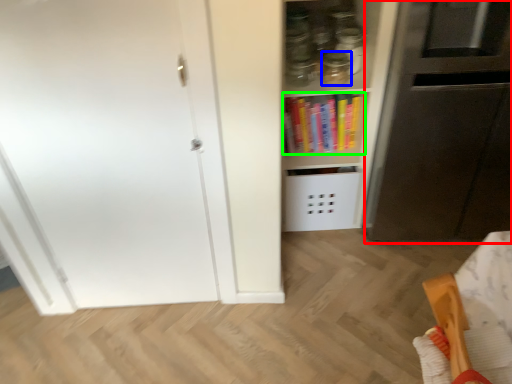
Question: Estimate the real-world distances between objects in this image. Which object is farther from appliance (highlighted by a red box), glass jar (highlighted by a blue box) or book (highlighted by a green box)?

Choices:
 (A) glass jar
 (B) book

Answer: (A)